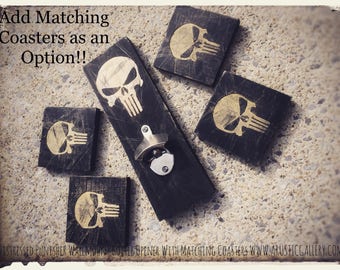
The width and height of the screenshot is (340, 270). Identify the location of floor. (288, 195).